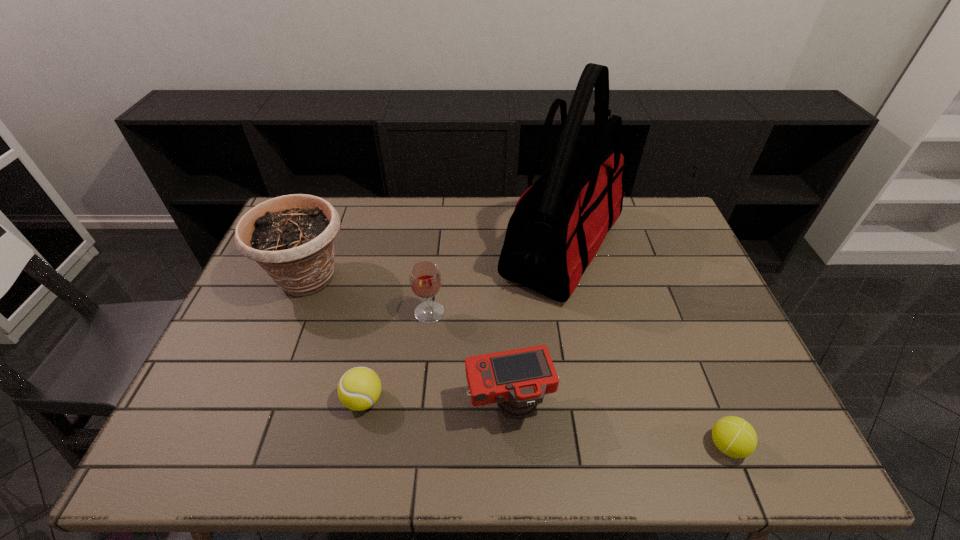
Locate an element on the screen. free area in between the duffel bag and the third object from left to right is located at coordinates (495, 280).

This screenshot has height=540, width=960. What are the coordinates of `free space between the right tennis ball and the tallest object` in the screenshot? It's located at (644, 347).

The image size is (960, 540). Find the location of `vacant region between the tallest object and the shortest object`. vacant region between the tallest object and the shortest object is located at coordinates (644, 347).

The width and height of the screenshot is (960, 540). In order to click on vacant area that lies between the camera and the shortest object in this screenshot , I will do `click(618, 425)`.

You are a GUI agent. You are given a task and a screenshot of the screen. Output one action in this format:
    pyautogui.click(x=<x>, y=<y>)
    Task: Click on the free spot between the left tennis ball and the shorter tennis ball
    
    Given the screenshot: What is the action you would take?
    pyautogui.click(x=545, y=423)

Locate an element on the screen. This screenshot has height=540, width=960. object that is the fourth closest one to the camera is located at coordinates (733, 436).

Find the location of a particular element. The image size is (960, 540). object that is the second closest to the shorter tennis ball is located at coordinates (559, 223).

Locate an element on the screen. vacant space that satisfies the following two spatial constraints: 1. on the front side of the leftmost object; 2. on the left side of the left tennis ball is located at coordinates (260, 400).

The height and width of the screenshot is (540, 960). Identify the location of free space that satisfies the following two spatial constraints: 1. on the front side of the wineglass; 2. on the right side of the camera. (420, 404).

Where is `free space that satisfies the following two spatial constraints: 1. on the front side of the farther tennis ball; 2. on the right side of the camera`? free space that satisfies the following two spatial constraints: 1. on the front side of the farther tennis ball; 2. on the right side of the camera is located at coordinates (363, 404).